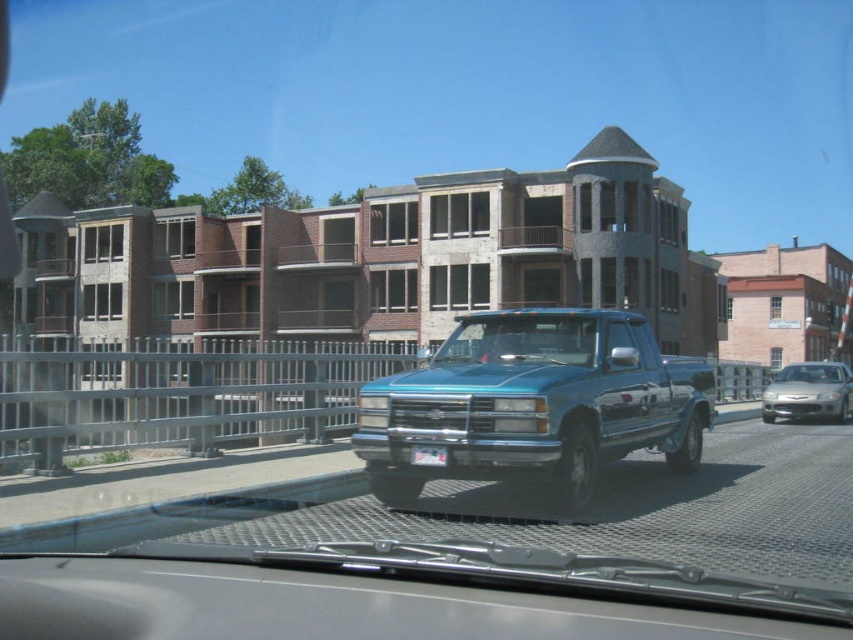
Which of these two, clear glass windshield at center or silver metallic sedan at right, stands shorter?

With less height is clear glass windshield at center.

Can you confirm if clear glass windshield at center is taller than silver metallic sedan at right?

Incorrect, clear glass windshield at center's height is not larger of silver metallic sedan at right's.

The image size is (853, 640). What do you see at coordinates (520, 339) in the screenshot? I see `clear glass windshield at center` at bounding box center [520, 339].

The width and height of the screenshot is (853, 640). In order to click on clear glass windshield at center in this screenshot , I will do `click(520, 339)`.

Does silver metallic sedan at right have a lesser height compared to white plastic license plate at center?

No, silver metallic sedan at right is not shorter than white plastic license plate at center.

Between point (828, 368) and point (412, 449), which one is positioned behind?

The point (828, 368) is behind.

Image resolution: width=853 pixels, height=640 pixels. Describe the element at coordinates (809, 392) in the screenshot. I see `silver metallic sedan at right` at that location.

The width and height of the screenshot is (853, 640). I want to click on silver metallic sedan at right, so click(809, 392).

Between metallic blue pickup truck at center and white plastic license plate at center, which one appears on the right side from the viewer's perspective?

metallic blue pickup truck at center is more to the right.

The height and width of the screenshot is (640, 853). I want to click on metallic blue pickup truck at center, so click(x=534, y=403).

Where is `metallic blue pickup truck at center`? This screenshot has height=640, width=853. metallic blue pickup truck at center is located at coordinates (534, 403).